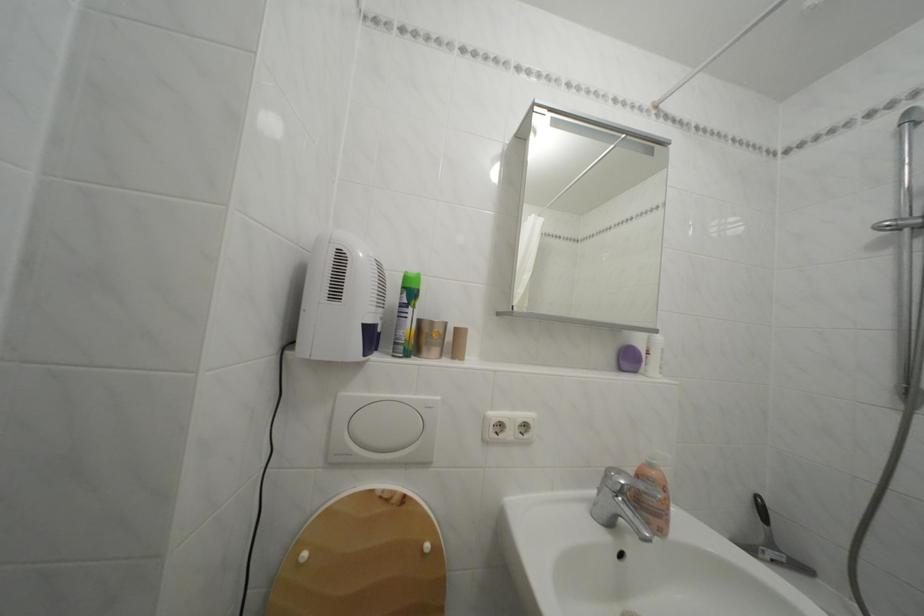
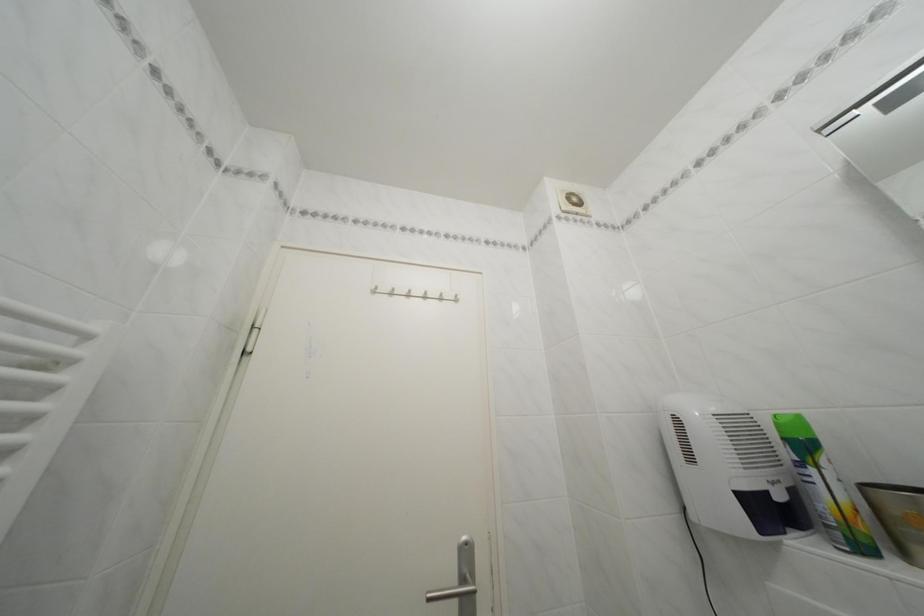
Find the pixel in the second image that matches the point at 345,300 in the first image.

(699, 464)